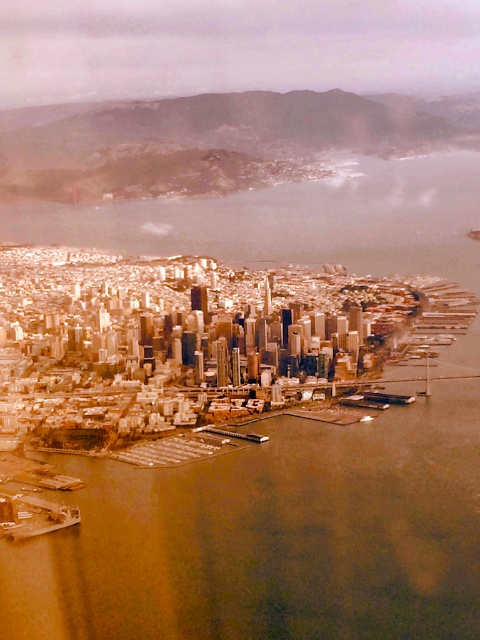
Is brown water at center below white plastic boat at lower right?

Yes.

Is point (226, 621) less distant than point (429, 369)?

Yes, it is.

Locate an element on the screen. The image size is (480, 640). brown water at center is located at coordinates (272, 532).

Between brown water at center and metallic gray boat at lower left, which one is positioned higher?

brown water at center

Is brown water at center bigger than metallic gray boat at lower left?

Yes, brown water at center is bigger than metallic gray boat at lower left.

Describe the element at coordinates (272, 532) in the screenshot. I see `brown water at center` at that location.

The width and height of the screenshot is (480, 640). Find the location of `brown water at center`. brown water at center is located at coordinates (272, 532).

Is metallic gray boat at lower left smaller than white plastic boat at lower right?

No.

What do you see at coordinates (34, 516) in the screenshot? I see `metallic gray boat at lower left` at bounding box center [34, 516].

This screenshot has height=640, width=480. In order to click on metallic gray boat at lower left in this screenshot , I will do `click(34, 516)`.